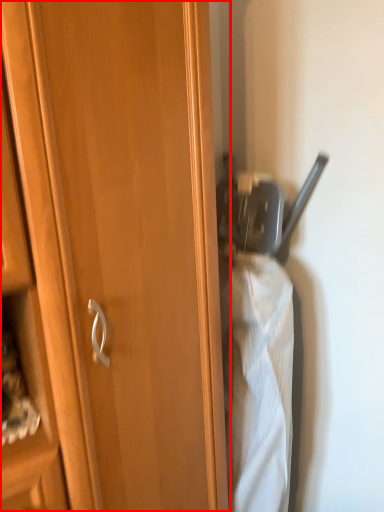
Question: From the image's perspective, considering the relative positions of cupboard (annotated by the red box) and wide in the image provided, where is cupboard (annotated by the red box) located with respect to the staircase?

Choices:
 (A) below
 (B) above

Answer: (B)